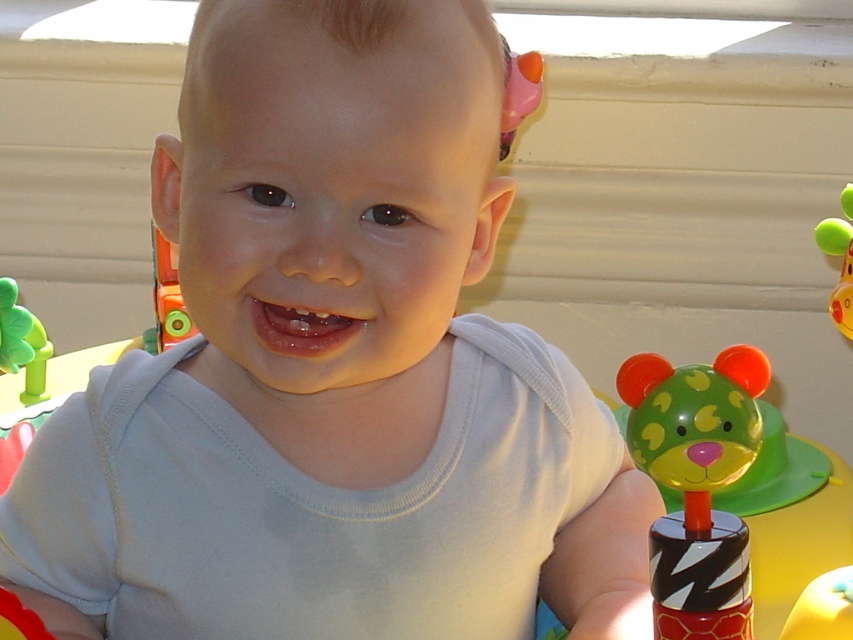
You are a parent trying to give your baby a toy. You see the green matte bear at right and the green rubber toy at left. Which toy is positioned more to the right side?

The green matte bear at right is positioned more to the right side than the green rubber toy at left.